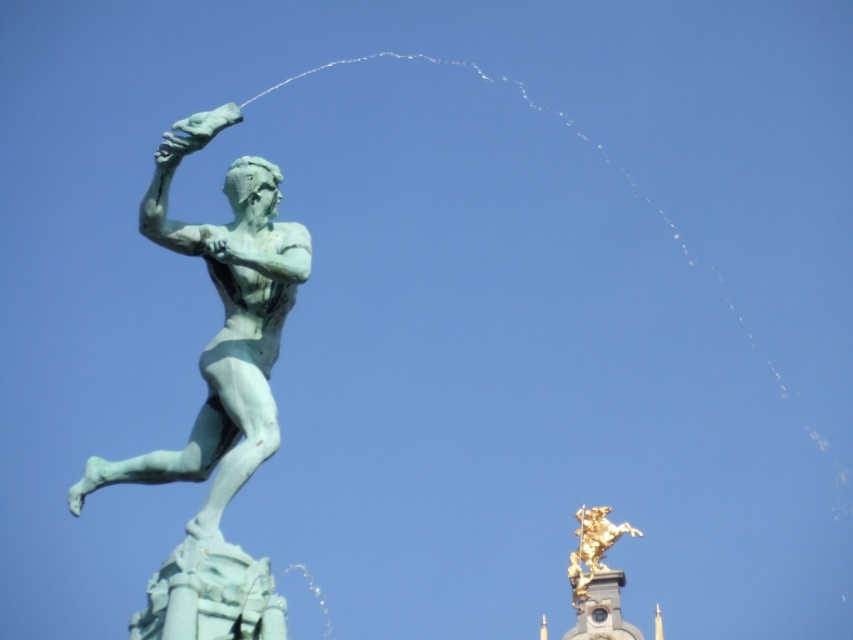
Between point (194, 433) and point (592, 513), which one is positioned in front?

Positioned in front is point (194, 433).

Does green patina statue at left have a larger size compared to gold metallic horse at upper right?

Indeed, green patina statue at left has a larger size compared to gold metallic horse at upper right.

Find the location of a particular element. green patina statue at left is located at coordinates (223, 323).